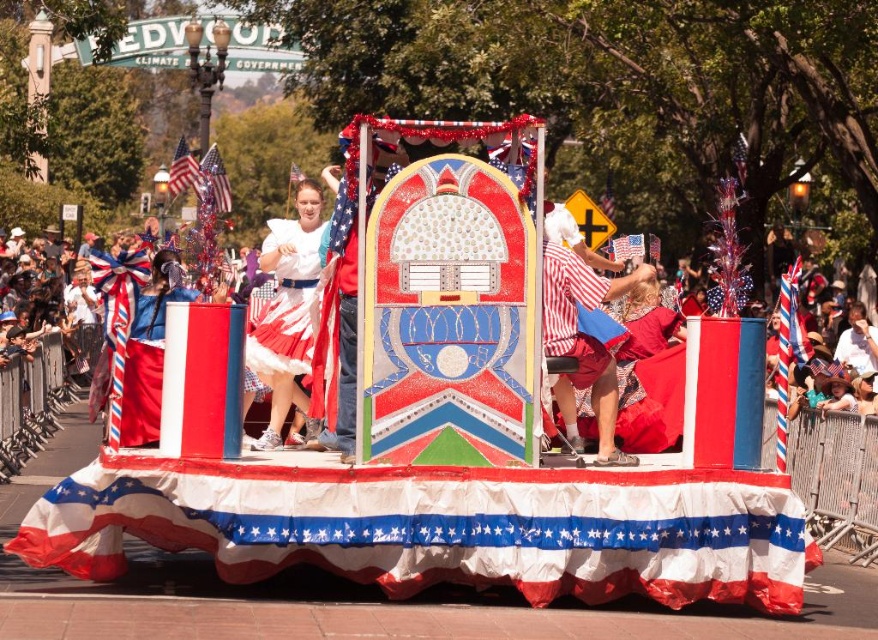
Question: Which object is closer to the camera taking this photo?

Choices:
 (A) red fabric flag at upper left
 (B) red fabric flag at center

Answer: (A)

Question: Does shiny metallic flag at upper left appear under red fabric flag at upper left?

Choices:
 (A) yes
 (B) no

Answer: (A)

Question: Does white striped fabric at center have a lesser width compared to shiny metallic flag at upper left?

Choices:
 (A) yes
 (B) no

Answer: (A)

Question: Does white striped fabric at center have a smaller size compared to striped barber pole at center?

Choices:
 (A) yes
 (B) no

Answer: (A)

Question: Which object is positioned closest to the striped barber pole at center?

Choices:
 (A) white striped fabric at center
 (B) white satin dress at center

Answer: (B)

Question: Among these objects, which one is nearest to the camera?

Choices:
 (A) striped barber pole at center
 (B) white satin dress at center

Answer: (A)